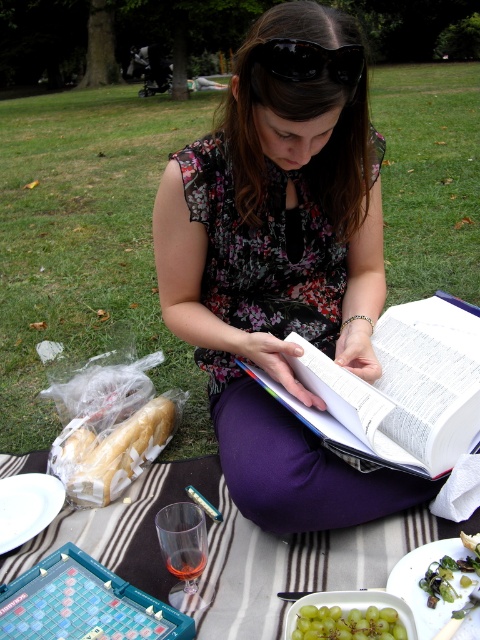
You are planning to place a small salad bowl between the white bread at lower left and the black plastic goggles at center. Based on their current positions, where should you position the salad bowl?

The white bread at lower left is positioned on the left side of black plastic goggles at center, so you should place the salad bowl to the right of the white bread at lower left and to the left of the black plastic goggles at center.

You are standing in the park and see two points in the image. The first point is at coordinate point (139, 458) and the second point is at coordinate point (324, 64). Which point is closer to you?

Point (139, 458) is closer to you than point (324, 64) because it is further to the viewer.

You are a photographer wanting to capture the white paper book at center and the white ceramic plate at lower left in the same frame. Based on their sizes, which object would appear larger in the photo?

The white paper book at center would appear larger in the photo since it is much taller than the white ceramic plate at lower left according to the description.